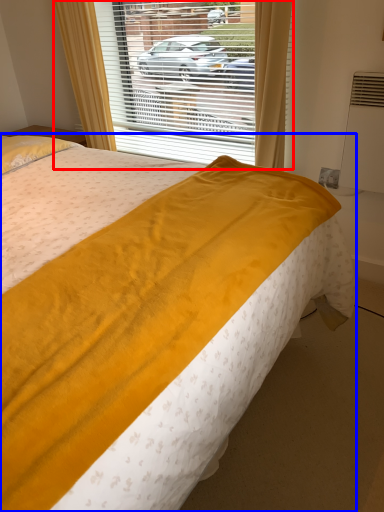
Question: Which point is closer to the camera, window (highlighted by a red box) or bed (highlighted by a blue box)?

Choices:
 (A) window
 (B) bed

Answer: (B)